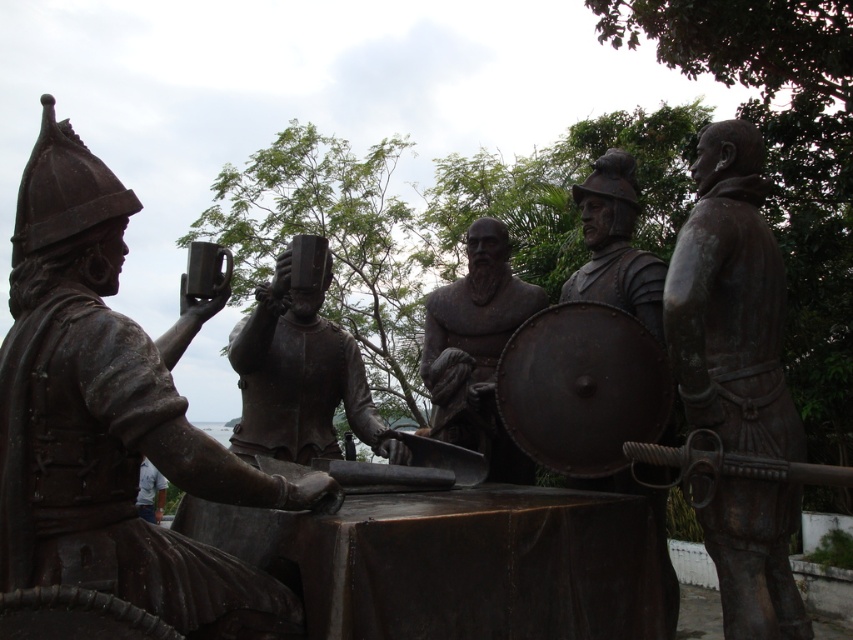
Question: Considering the relative positions of bronze helmet at upper left and bronze helmet at center in the image provided, where is bronze helmet at upper left located with respect to bronze helmet at center?

Choices:
 (A) left
 (B) right

Answer: (A)

Question: Is bronze shield at right further to camera compared to bronze helmet at center?

Choices:
 (A) yes
 (B) no

Answer: (B)

Question: Can you confirm if bronze helmet at upper left is positioned to the right of bronze shield at right?

Choices:
 (A) no
 (B) yes

Answer: (A)

Question: Which object is closer to the camera taking this photo?

Choices:
 (A) bronze shield at right
 (B) bronze helmet at upper left
 (C) bronze helmet at center

Answer: (B)

Question: Which point is farther to the camera?

Choices:
 (A) bronze shield at right
 (B) bronze helmet at center
 (C) bronze helmet at upper left

Answer: (B)

Question: Estimate the real-world distances between objects in this image. Which object is farther from the bronze helmet at center?

Choices:
 (A) bronze shield at right
 (B) bronze helmet at upper left

Answer: (A)